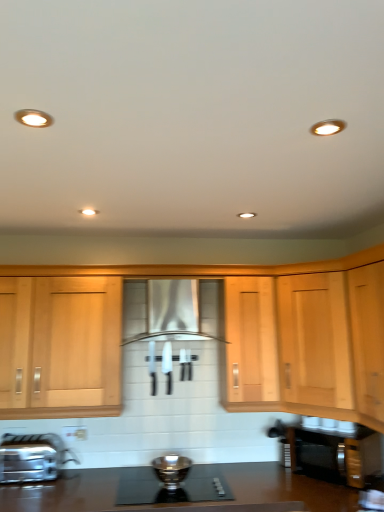
Question: Would you consider satin silver bowl at center to be distant from satin nickel faucet at lower left?

Choices:
 (A) yes
 (B) no

Answer: (B)

Question: Is satin silver bowl at center thinner than satin nickel faucet at lower left?

Choices:
 (A) no
 (B) yes

Answer: (A)

Question: Is satin silver bowl at center located outside satin nickel faucet at lower left?

Choices:
 (A) no
 (B) yes

Answer: (B)

Question: Is satin silver bowl at center at the right side of satin nickel faucet at lower left?

Choices:
 (A) no
 (B) yes

Answer: (B)

Question: Considering the relative sizes of satin silver bowl at center and satin nickel faucet at lower left in the image provided, is satin silver bowl at center taller than satin nickel faucet at lower left?

Choices:
 (A) no
 (B) yes

Answer: (A)

Question: Considering the positions of white plastic electric outlet at lower center and black glass gas stove at center in the image, is white plastic electric outlet at lower center bigger or smaller than black glass gas stove at center?

Choices:
 (A) small
 (B) big

Answer: (A)

Question: From their relative heights in the image, would you say white plastic electric outlet at lower center is taller or shorter than black glass gas stove at center?

Choices:
 (A) tall
 (B) short

Answer: (A)

Question: From a real-world perspective, relative to black glass gas stove at center, is white plastic electric outlet at lower center vertically above or below?

Choices:
 (A) above
 (B) below

Answer: (A)

Question: In terms of width, does white plastic electric outlet at lower center look wider or thinner when compared to black glass gas stove at center?

Choices:
 (A) wide
 (B) thin

Answer: (B)

Question: From a real-world perspective, relative to satin silver bowl at center, is light wood cabinet at right vertically above or below?

Choices:
 (A) above
 (B) below

Answer: (A)

Question: From their relative heights in the image, would you say light wood cabinet at right is taller or shorter than satin silver bowl at center?

Choices:
 (A) short
 (B) tall

Answer: (B)

Question: In the image, is light wood cabinet at right positioned in front of or behind satin silver bowl at center?

Choices:
 (A) behind
 (B) front

Answer: (A)

Question: From the image's perspective, is light wood cabinet at right located above or below satin silver bowl at center?

Choices:
 (A) above
 (B) below

Answer: (A)

Question: Does point (162, 462) appear closer or farther from the camera than point (296, 348)?

Choices:
 (A) closer
 (B) farther

Answer: (A)

Question: In terms of height, does satin silver bowl at center look taller or shorter compared to light wood cabinet at right?

Choices:
 (A) short
 (B) tall

Answer: (A)